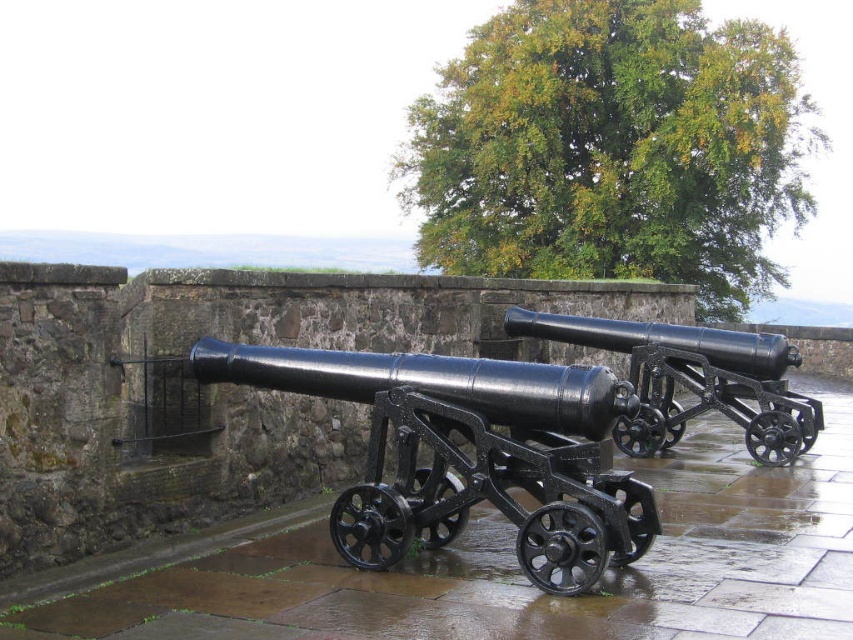
The height and width of the screenshot is (640, 853). Find the location of `matte black cannon at center`. matte black cannon at center is located at coordinates (466, 452).

Measure the distance between point (422, 436) and camera.

Point (422, 436) and camera are 9.77 meters apart from each other.

This screenshot has width=853, height=640. What do you see at coordinates (466, 452) in the screenshot? I see `matte black cannon at center` at bounding box center [466, 452].

You are a GUI agent. You are given a task and a screenshot of the screen. Output one action in this format:
    pyautogui.click(x=<x>, y=<y>)
    Task: Click on the matte black cannon at center
    The image size is (853, 640).
    Given the screenshot: What is the action you would take?
    pyautogui.click(x=466, y=452)